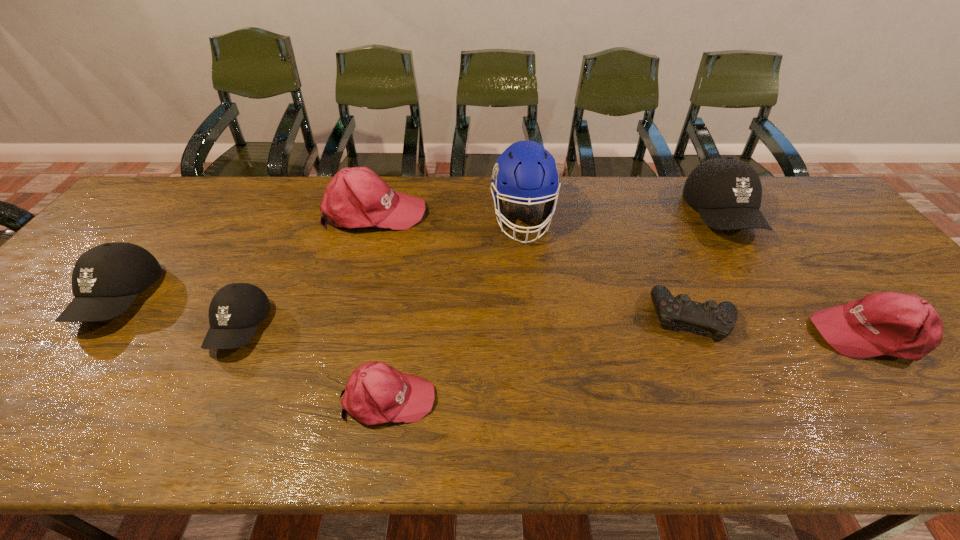
What are the coordinates of `the second black baseball cap from left to right` in the screenshot? It's located at (235, 311).

Identify the location of the nearest baseball cap. (376, 393).

The width and height of the screenshot is (960, 540). I want to click on the nearest red baseball cap, so click(376, 393).

This screenshot has height=540, width=960. I want to click on the shortest object, so click(719, 319).

You are a GUI agent. You are given a task and a screenshot of the screen. Output one action in this format:
    pyautogui.click(x=<x>, y=<y>)
    Task: Click on the third object from right to left
    Image resolution: width=960 pixels, height=540 pixels.
    Given the screenshot: What is the action you would take?
    pyautogui.click(x=719, y=319)

Locate an element on the screen. This screenshot has width=960, height=540. vacant space situated 0.120m on the front-facing side of the fourth object from right to left is located at coordinates (530, 279).

You are a GUI agent. You are given a task and a screenshot of the screen. Output one action in this format:
    pyautogui.click(x=<x>, y=<y>)
    Task: Click on the blank area located 0.380m on the front-facing side of the biggest black baseball cap
    
    Given the screenshot: What is the action you would take?
    pyautogui.click(x=815, y=364)

Identify the location of blank area located at the front of the biggest red baseball cap with the brim. Image resolution: width=960 pixels, height=540 pixels. (491, 212).

This screenshot has width=960, height=540. Find the location of `vacant space situated on the front-facing side of the leftmost black baseball cap`. vacant space situated on the front-facing side of the leftmost black baseball cap is located at coordinates (12, 434).

The width and height of the screenshot is (960, 540). Identify the location of vacant point located 0.360m at the front of the second biggest red baseball cap with the brim. (662, 335).